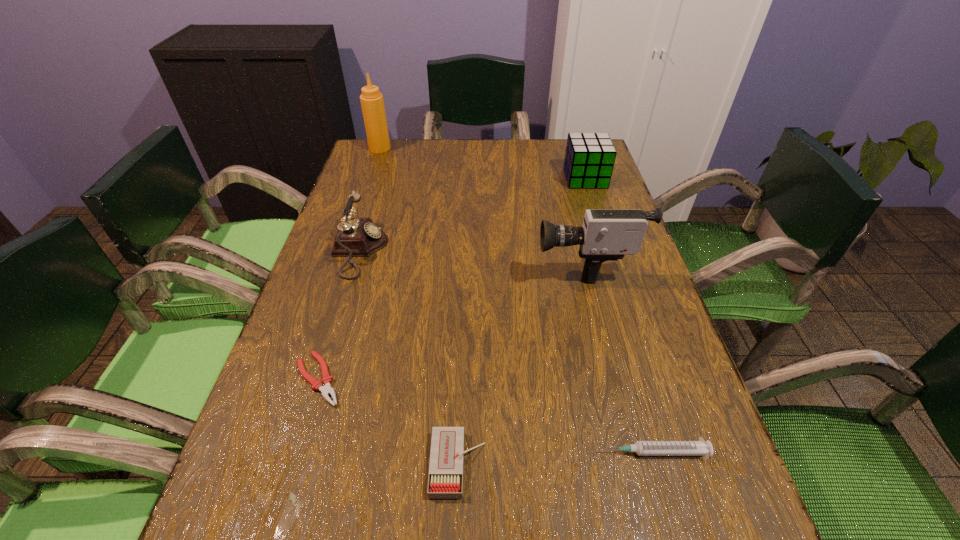
Locate an element on the screen. This screenshot has height=540, width=960. free space between the sixth tallest object and the pliers is located at coordinates (486, 416).

The width and height of the screenshot is (960, 540). Identify the location of vacant space in between the second tallest object and the matchbox. (521, 363).

Locate an element on the screen. The height and width of the screenshot is (540, 960). free spot between the farthest object and the pliers is located at coordinates (349, 264).

This screenshot has height=540, width=960. I want to click on empty space between the condiment and the camcorder, so click(x=482, y=206).

Identify the location of vacant area that lies between the cube and the fifth tallest object. (521, 321).

Identify which object is the second closest to the cube. Please provide its 2D coordinates. Your answer should be formatted as a tuple, i.e. [(x, y)], where the tuple contains the x and y coordinates of a point satisfying the conditions above.

[(357, 237)]

Identify which object is the second nearest to the syringe. Please provide its 2D coordinates. Your answer should be formatted as a tuple, i.e. [(x, y)], where the tuple contains the x and y coordinates of a point satisfying the conditions above.

[(606, 234)]

This screenshot has width=960, height=540. In order to click on free spot that satisfies the following two spatial constraints: 1. on the dial of the telephone; 2. on the front side of the shortest object in this screenshot , I will do `click(321, 379)`.

Locate an element on the screen. The image size is (960, 540). vacant position in the image that satisfies the following two spatial constraints: 1. on the dial of the telephone; 2. on the front side of the pliers is located at coordinates (321, 379).